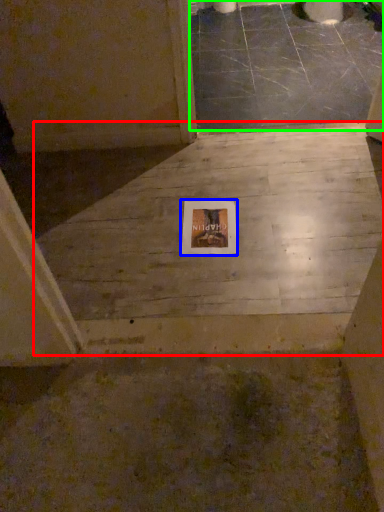
Question: Based on their relative distances, which object is farther from concrete (highlighted by a red box)? Choose from picture frame (highlighted by a blue box) and concrete (highlighted by a green box).

Choices:
 (A) picture frame
 (B) concrete

Answer: (B)